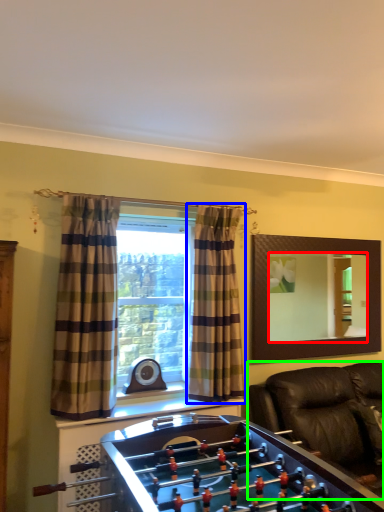
Question: Considering the real-world distances, which object is farthest from mirror (highlighted by a red box)? curtain (highlighted by a blue box) or studio couch (highlighted by a green box)?

Choices:
 (A) curtain
 (B) studio couch

Answer: (A)